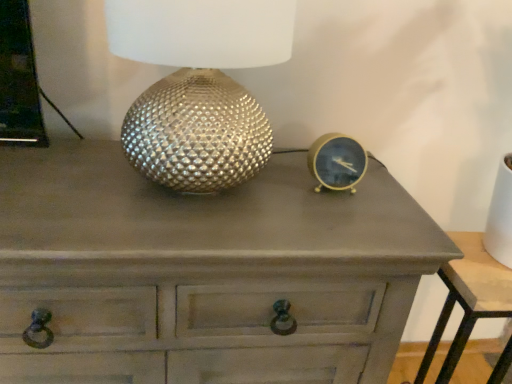
Question: Can you confirm if matte gray nightstand at lower right is thinner than metallic textured lamp at center?

Choices:
 (A) no
 (B) yes

Answer: (A)

Question: Can you confirm if matte gray nightstand at lower right is wider than metallic textured lamp at center?

Choices:
 (A) no
 (B) yes

Answer: (B)

Question: From the image's perspective, is matte gray nightstand at lower right on metallic textured lamp at center?

Choices:
 (A) no
 (B) yes

Answer: (A)

Question: Is matte gray nightstand at lower right to the right of metallic textured lamp at center from the viewer's perspective?

Choices:
 (A) yes
 (B) no

Answer: (A)

Question: Is matte gray nightstand at lower right located outside metallic textured lamp at center?

Choices:
 (A) yes
 (B) no

Answer: (A)

Question: Considering the positions of matte gray nightstand at lower right and gold metallic clock at right in the image, is matte gray nightstand at lower right wider or thinner than gold metallic clock at right?

Choices:
 (A) wide
 (B) thin

Answer: (A)

Question: From a real-world perspective, is matte gray nightstand at lower right above or below gold metallic clock at right?

Choices:
 (A) below
 (B) above

Answer: (A)

Question: In terms of size, does matte gray nightstand at lower right appear bigger or smaller than gold metallic clock at right?

Choices:
 (A) small
 (B) big

Answer: (B)

Question: Would you say matte gray nightstand at lower right is to the left or to the right of gold metallic clock at right in the picture?

Choices:
 (A) right
 (B) left

Answer: (A)

Question: Do you think matte gray chest of drawers at center is within metallic textured lamp at center, or outside of it?

Choices:
 (A) inside
 (B) outside

Answer: (B)

Question: In terms of size, does matte gray chest of drawers at center appear bigger or smaller than metallic textured lamp at center?

Choices:
 (A) big
 (B) small

Answer: (A)

Question: Considering the relative positions of matte gray chest of drawers at center and metallic textured lamp at center in the image provided, is matte gray chest of drawers at center to the left or to the right of metallic textured lamp at center?

Choices:
 (A) right
 (B) left

Answer: (B)

Question: Considering the positions of matte gray chest of drawers at center and metallic textured lamp at center in the image, is matte gray chest of drawers at center taller or shorter than metallic textured lamp at center?

Choices:
 (A) tall
 (B) short

Answer: (A)

Question: Which is correct: matte gray chest of drawers at center is inside matte gray nightstand at lower right, or outside of it?

Choices:
 (A) outside
 (B) inside

Answer: (A)

Question: Is point (179, 268) closer or farther from the camera than point (476, 256)?

Choices:
 (A) closer
 (B) farther

Answer: (A)